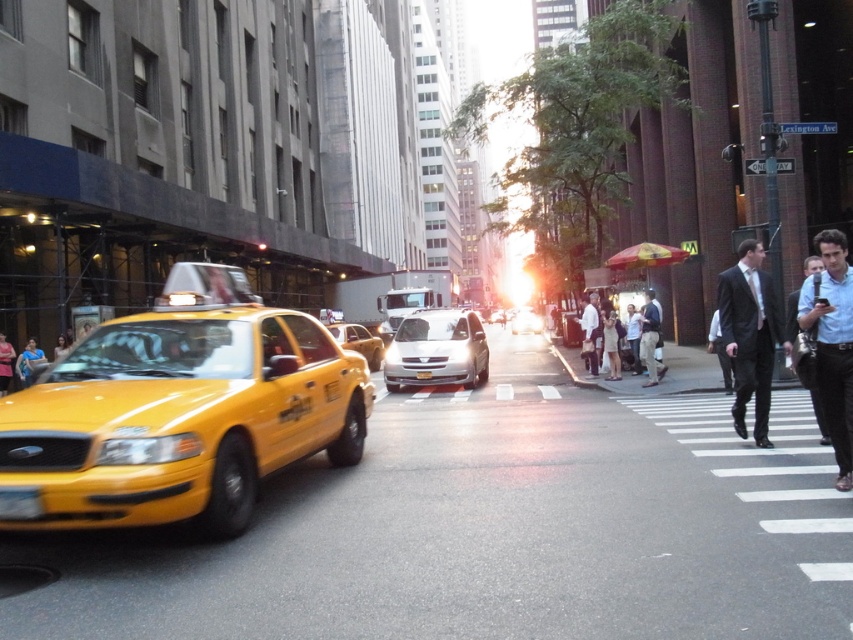
Question: Which object appears closest to the camera in this image?

Choices:
 (A) dark suit at center
 (B) khaki cotton pants at center

Answer: (A)

Question: Which point appears farthest from the camera in this image?

Choices:
 (A) (361, 326)
 (B) (190, 387)
 (C) (619, 333)

Answer: (A)

Question: Can you confirm if silver metallic van at center is bigger than khaki cotton pants at center?

Choices:
 (A) no
 (B) yes

Answer: (B)

Question: Is the position of dark gray suit at right more distant than that of shiny silver sedan at center?

Choices:
 (A) yes
 (B) no

Answer: (B)

Question: Which object appears farthest from the camera in this image?

Choices:
 (A) blue shirt at center
 (B) shiny silver sedan at center
 (C) silver metallic van at center

Answer: (B)

Question: Is silver metallic van at center smaller than dark suit at center?

Choices:
 (A) no
 (B) yes

Answer: (B)